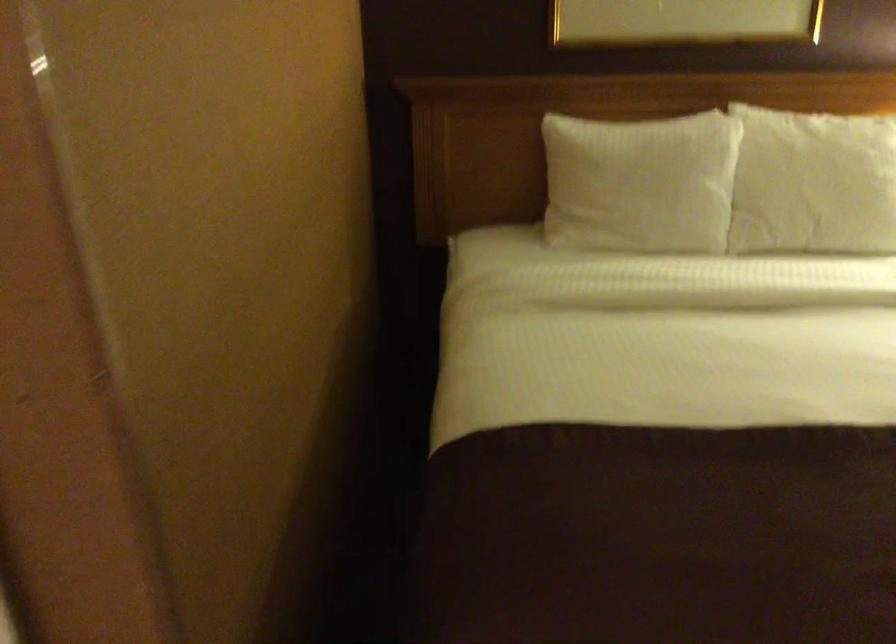
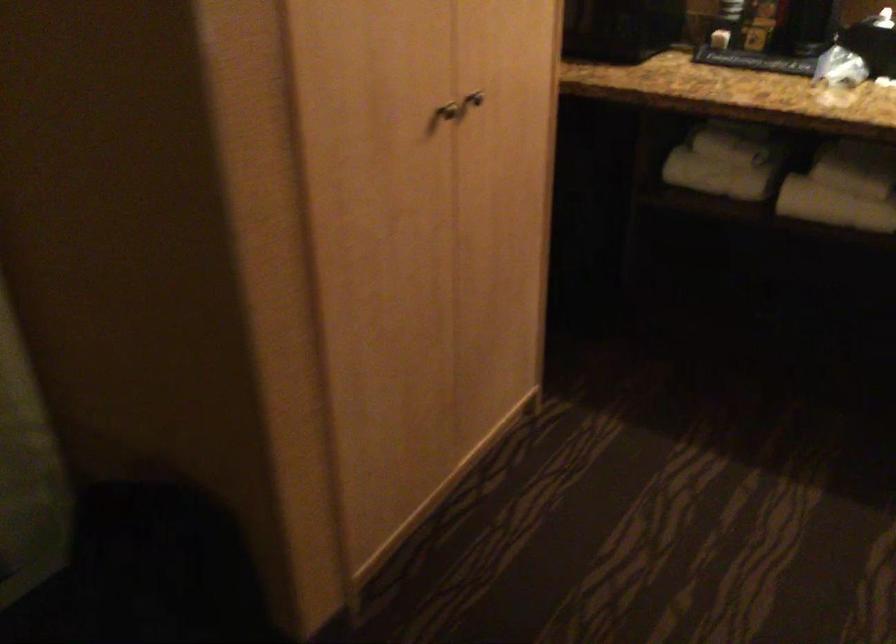
First-person continuous shooting, in which direction is the camera rotating?

The rotation direction of the camera is left-down.